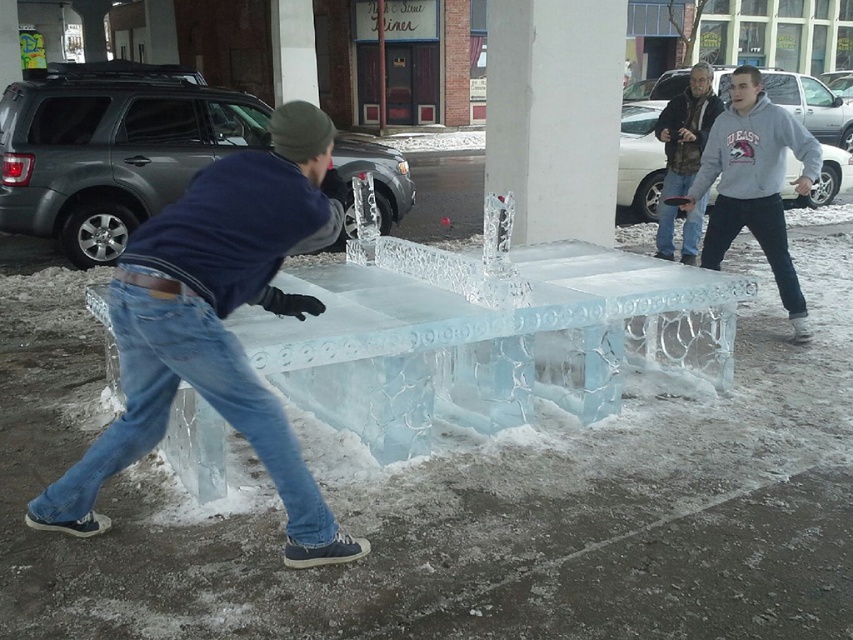
Question: Is white smooth concrete pillar at center to the right of gray fleece sweatshirt at right from the viewer's perspective?

Choices:
 (A) yes
 (B) no

Answer: (B)

Question: Based on their relative distances, which object is nearer to the gray fleece sweatshirt at right?

Choices:
 (A) blue jeans at center
 (B) white smooth concrete pillar at center

Answer: (A)

Question: Which object appears closest to the camera in this image?

Choices:
 (A) gray fleece sweatshirt at right
 (B) blue denim jeans at lower left

Answer: (B)

Question: Can you confirm if blue denim jeans at lower left is thinner than blue jeans at center?

Choices:
 (A) no
 (B) yes

Answer: (A)

Question: Does blue denim jeans at lower left have a lesser width compared to blue jeans at center?

Choices:
 (A) yes
 (B) no

Answer: (B)

Question: Among these points, which one is farthest from the camera?

Choices:
 (A) pos(683,186)
 (B) pos(531,61)

Answer: (A)